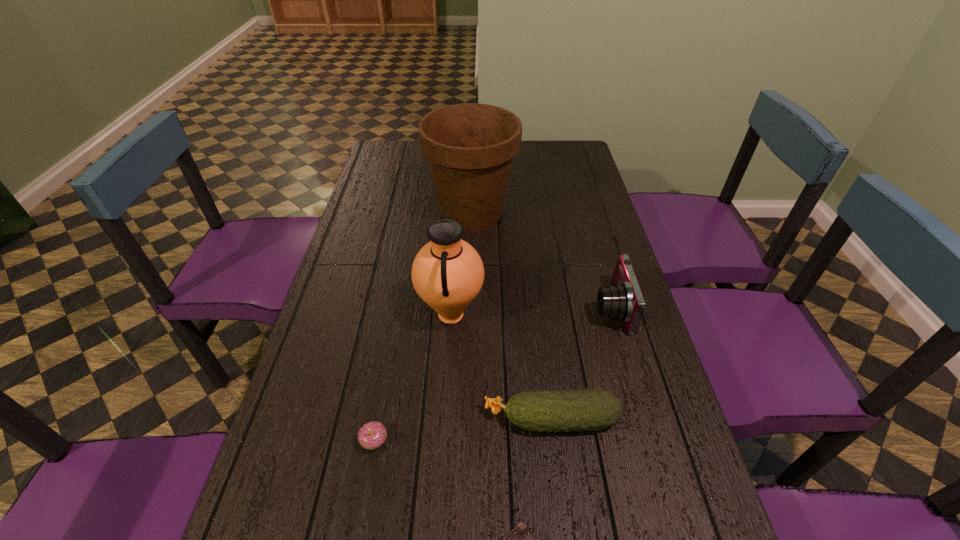
You are a GUI agent. You are given a task and a screenshot of the screen. Output one action in this format:
    pyautogui.click(x=<x>, y=<y>)
    Task: Click on the farthest object
    Image resolution: width=960 pixels, height=540 pixels.
    Given the screenshot: What is the action you would take?
    pyautogui.click(x=470, y=147)

You are a GUI agent. You are given a task and a screenshot of the screen. Output one action in this format:
    pyautogui.click(x=<x>, y=<y>)
    Task: Click on the pitcher
    The height and width of the screenshot is (540, 960).
    Given the screenshot: What is the action you would take?
    pyautogui.click(x=447, y=273)

Identify the location of the rightmost object. The height and width of the screenshot is (540, 960). (624, 300).

Locate an element on the screen. The height and width of the screenshot is (540, 960). the third tallest object is located at coordinates (624, 300).

This screenshot has width=960, height=540. I want to click on cucumber, so click(593, 409).

Where is `cupcake`? The image size is (960, 540). cupcake is located at coordinates (372, 435).

You are a GUI agent. You are given a task and a screenshot of the screen. Output one action in this format:
    pyautogui.click(x=<x>, y=<y>)
    Task: Click on the vacant space positioned on the right of the farthest object
    The height and width of the screenshot is (540, 960).
    Given the screenshot: What is the action you would take?
    pyautogui.click(x=564, y=213)

Locate an element on the screen. This screenshot has height=540, width=960. vacant space located 0.260m on the front of the pitcher is located at coordinates (443, 444).

Locate an element on the screen. free location located 0.310m on the front-facing side of the camera is located at coordinates (482, 308).

Locate an element on the screen. The width and height of the screenshot is (960, 540). blank area located on the front-facing side of the camera is located at coordinates (457, 308).